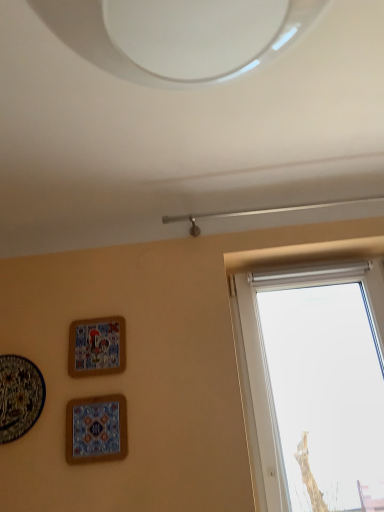
Question: Is matte ceramic picture frame at upper left, placed as the 2th picture frame when sorted from right to left, located within matte ceramic tile at lower left, marked as the first picture frame in a right-to-left arrangement?

Choices:
 (A) yes
 (B) no

Answer: (B)

Question: Is the position of matte ceramic tile at lower left, the 3th picture frame positioned from the left, less distant than that of matte ceramic picture frame at upper left, positioned as the second picture frame in left-to-right order?

Choices:
 (A) yes
 (B) no

Answer: (A)

Question: Would you say matte ceramic tile at lower left, marked as the first picture frame in a right-to-left arrangement, is outside matte ceramic picture frame at upper left, positioned as the second picture frame in left-to-right order?

Choices:
 (A) yes
 (B) no

Answer: (A)

Question: Considering the relative sizes of matte ceramic tile at lower left, marked as the first picture frame in a right-to-left arrangement, and matte ceramic picture frame at upper left, placed as the 2th picture frame when sorted from right to left, in the image provided, is matte ceramic tile at lower left, marked as the first picture frame in a right-to-left arrangement, shorter than matte ceramic picture frame at upper left, placed as the 2th picture frame when sorted from right to left,?

Choices:
 (A) no
 (B) yes

Answer: (B)

Question: Is matte ceramic tile at lower left, marked as the first picture frame in a right-to-left arrangement, thinner than matte ceramic picture frame at upper left, positioned as the second picture frame in left-to-right order?

Choices:
 (A) yes
 (B) no

Answer: (A)

Question: Is matte ceramic tile at lower left, the 3th picture frame positioned from the left, touching matte ceramic picture frame at upper left, placed as the 2th picture frame when sorted from right to left?

Choices:
 (A) no
 (B) yes

Answer: (A)

Question: Is matte ceramic picture frame at upper left, positioned as the second picture frame in left-to-right order, thinner than matte ceramic tile at lower left, the 3th picture frame positioned from the left?

Choices:
 (A) yes
 (B) no

Answer: (B)

Question: Can you confirm if matte ceramic picture frame at upper left, placed as the 2th picture frame when sorted from right to left, is smaller than matte ceramic tile at lower left, marked as the first picture frame in a right-to-left arrangement?

Choices:
 (A) no
 (B) yes

Answer: (A)

Question: Is matte ceramic picture frame at upper left, positioned as the second picture frame in left-to-right order, oriented away from matte ceramic tile at lower left, marked as the first picture frame in a right-to-left arrangement?

Choices:
 (A) yes
 (B) no

Answer: (B)

Question: Can you confirm if matte ceramic picture frame at upper left, placed as the 2th picture frame when sorted from right to left, is taller than matte ceramic tile at lower left, marked as the first picture frame in a right-to-left arrangement?

Choices:
 (A) yes
 (B) no

Answer: (A)

Question: Considering the relative sizes of matte ceramic picture frame at upper left, positioned as the second picture frame in left-to-right order, and matte ceramic tile at lower left, marked as the first picture frame in a right-to-left arrangement, in the image provided, is matte ceramic picture frame at upper left, positioned as the second picture frame in left-to-right order, wider than matte ceramic tile at lower left, marked as the first picture frame in a right-to-left arrangement,?

Choices:
 (A) yes
 (B) no

Answer: (A)

Question: Is matte ceramic picture frame at upper left, positioned as the second picture frame in left-to-right order, in front of matte ceramic tile at lower left, the 3th picture frame positioned from the left?

Choices:
 (A) no
 (B) yes

Answer: (A)

Question: Considering the relative positions of matte ceramic picture frame at upper left, placed as the 2th picture frame when sorted from right to left, and matte ceramic plate at lower left, acting as the 3th picture frame starting from the right, in the image provided, is matte ceramic picture frame at upper left, placed as the 2th picture frame when sorted from right to left, to the right of matte ceramic plate at lower left, acting as the 3th picture frame starting from the right, from the viewer's perspective?

Choices:
 (A) no
 (B) yes

Answer: (B)